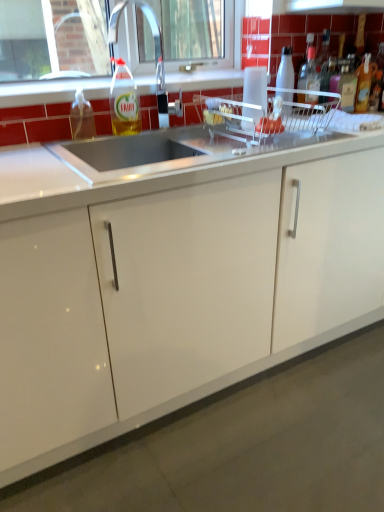
Where is `vacant area that lies to the right of translucent plastic container at upper center`? vacant area that lies to the right of translucent plastic container at upper center is located at coordinates (321, 135).